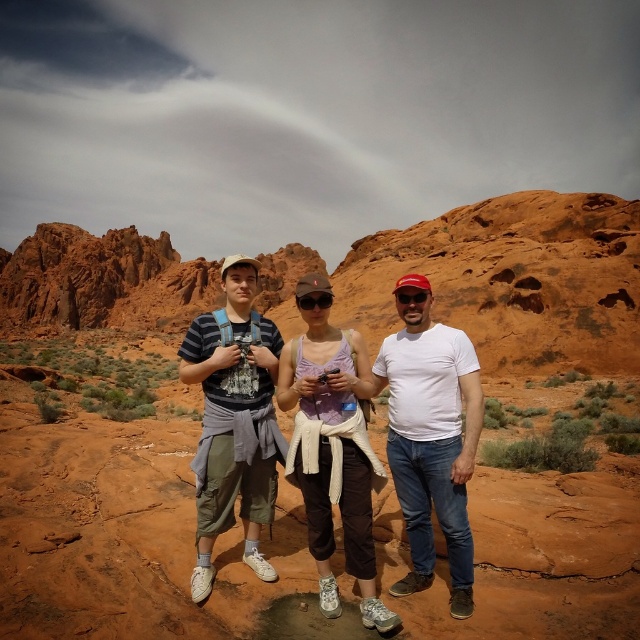
You are a photographer positioned at the edge of the desert landscape. You want to capture a photo of both the white matte shirt at center and the striped cotton shirt at center in the same frame. Given that your camera has a maximum focus range of 12 meters, will you be able to include both subjects in focus?

The white matte shirt at center is 12.46 meters away from the striped cotton shirt at center. Since the distance between them exceeds the camera maximum focus range of 12 meters, you won the camera cannot focus on both subjects simultaneously.

You are a photographer trying to capture a clear shot of the white matte shirt at center and the striped cotton shirt at center. Which one is closer to the camera?

The white matte shirt at center is positioned under the striped cotton shirt at center, so the striped cotton shirt at center is closer to the camera.